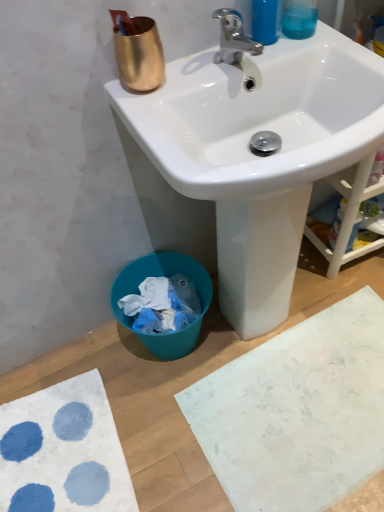
Question: Is the depth of chrome metallic faucet at upper center greater than that of white textured bath mat at lower left, marked as the first bath mat in a left-to-right arrangement?

Choices:
 (A) yes
 (B) no

Answer: (B)

Question: Is chrome metallic faucet at upper center turned away from white textured bath mat at lower left, marked as the first bath mat in a left-to-right arrangement?

Choices:
 (A) no
 (B) yes

Answer: (A)

Question: From the image's perspective, is chrome metallic faucet at upper center on top of white textured bath mat at lower left, positioned as the second bath mat in right-to-left order?

Choices:
 (A) no
 (B) yes

Answer: (B)

Question: Can you confirm if chrome metallic faucet at upper center is wider than white textured bath mat at lower left, marked as the first bath mat in a left-to-right arrangement?

Choices:
 (A) no
 (B) yes

Answer: (A)

Question: Is chrome metallic faucet at upper center surrounding white textured bath mat at lower left, positioned as the second bath mat in right-to-left order?

Choices:
 (A) no
 (B) yes

Answer: (A)

Question: Is white textured bath mat at lower left, marked as the first bath mat in a left-to-right arrangement, bigger or smaller than white glossy sink at upper center?

Choices:
 (A) small
 (B) big

Answer: (A)

Question: In the image, is white textured bath mat at lower left, marked as the first bath mat in a left-to-right arrangement, on the left side or the right side of white glossy sink at upper center?

Choices:
 (A) right
 (B) left

Answer: (B)

Question: From the image's perspective, relative to white glossy sink at upper center, is white textured bath mat at lower left, positioned as the second bath mat in right-to-left order, above or below?

Choices:
 (A) below
 (B) above

Answer: (A)

Question: Is white textured bath mat at lower left, marked as the first bath mat in a left-to-right arrangement, wider or thinner than white glossy sink at upper center?

Choices:
 (A) wide
 (B) thin

Answer: (B)

Question: From their relative heights in the image, would you say chrome metallic faucet at upper center is taller or shorter than translucent blue liquid at upper right?

Choices:
 (A) short
 (B) tall

Answer: (A)

Question: Is chrome metallic faucet at upper center bigger or smaller than translucent blue liquid at upper right?

Choices:
 (A) small
 (B) big

Answer: (B)

Question: From a real-world perspective, is chrome metallic faucet at upper center above or below translucent blue liquid at upper right?

Choices:
 (A) below
 (B) above

Answer: (A)

Question: Is chrome metallic faucet at upper center in front of or behind translucent blue liquid at upper right in the image?

Choices:
 (A) behind
 (B) front

Answer: (B)

Question: Is point (26, 446) closer or farther from the camera than point (301, 34)?

Choices:
 (A) farther
 (B) closer

Answer: (A)

Question: Considering the positions of white textured bath mat at lower left, marked as the first bath mat in a left-to-right arrangement, and translucent blue liquid at upper right in the image, is white textured bath mat at lower left, marked as the first bath mat in a left-to-right arrangement, taller or shorter than translucent blue liquid at upper right?

Choices:
 (A) short
 (B) tall

Answer: (A)